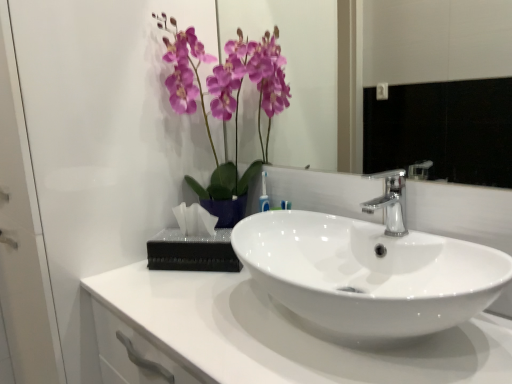
This screenshot has height=384, width=512. Identify the location of free space below white glossy sink at center (from a real-world perspective). (357, 343).